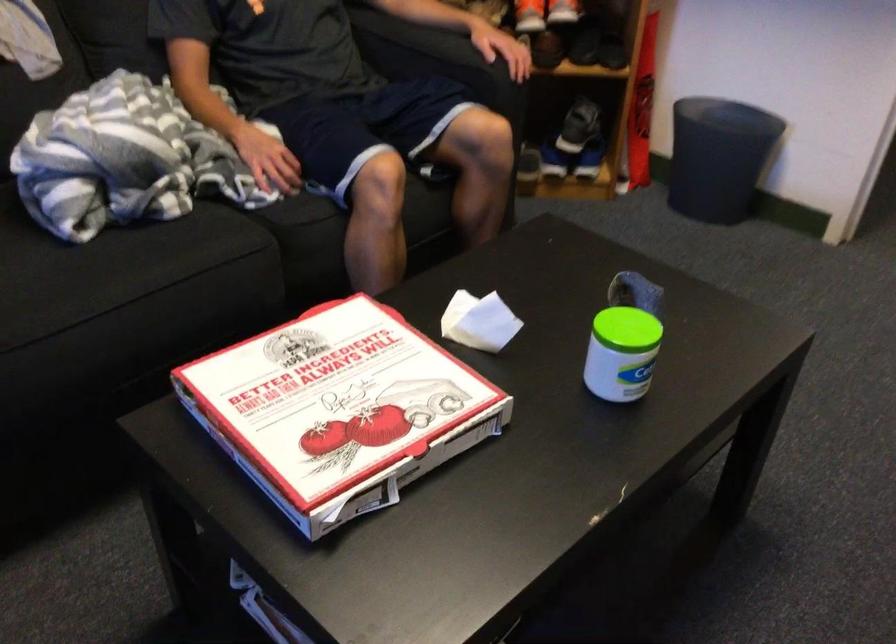
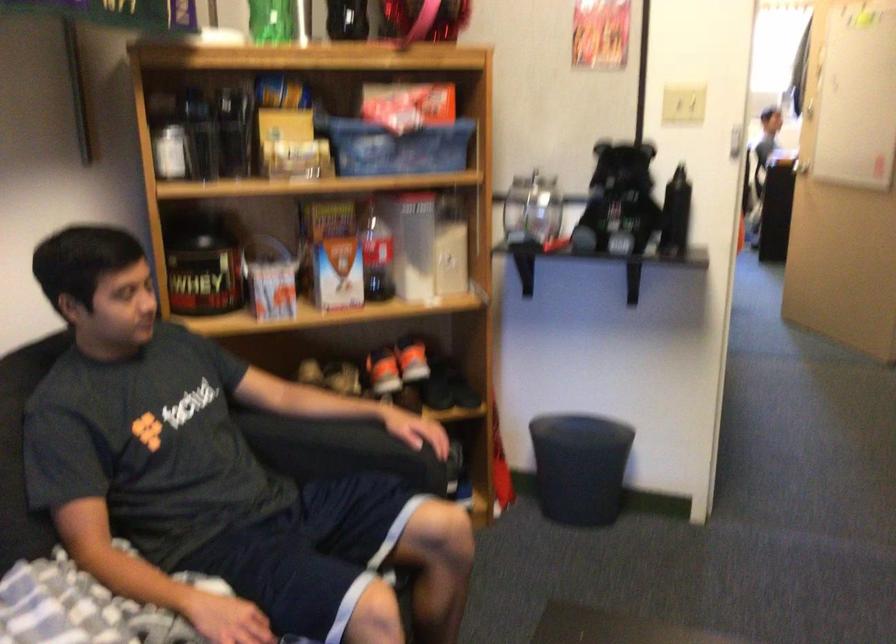
The images are taken continuously from a first-person perspective. In which direction is your viewpoint rotating?

The camera rotated toward right-up.